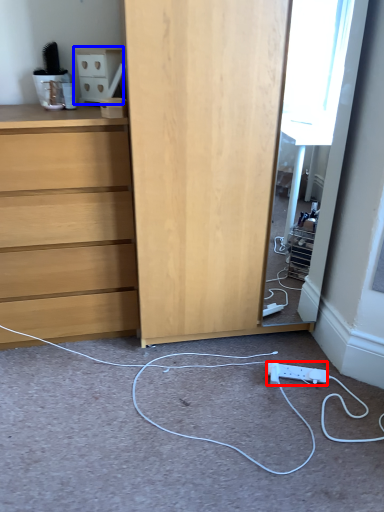
Question: Which point is closer to the camera, electric outlet (highlighted by a red box) or cabinetry (highlighted by a blue box)?

Choices:
 (A) electric outlet
 (B) cabinetry

Answer: (B)